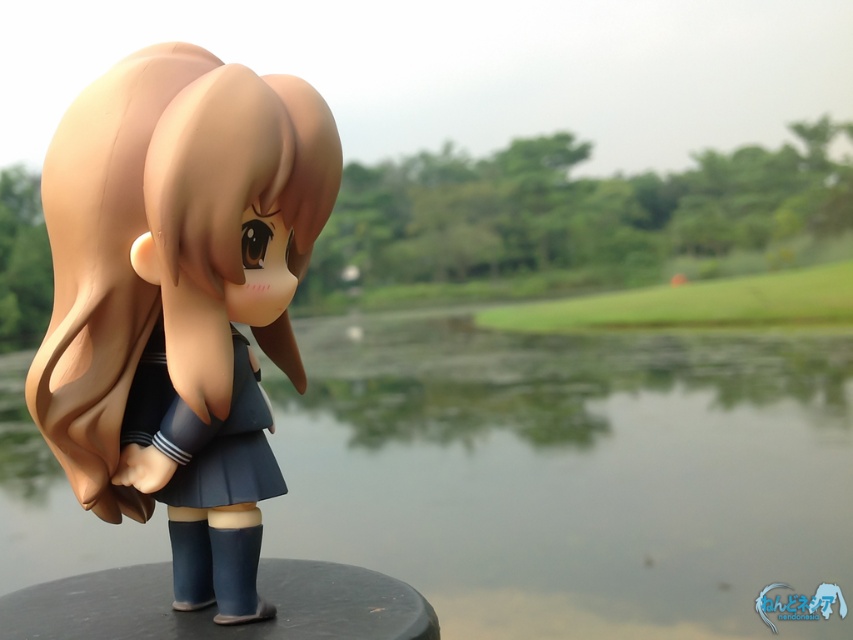
Question: Does transparent water at center come behind satin brown hair at center?

Choices:
 (A) no
 (B) yes

Answer: (B)

Question: Which of the following is the closest to the observer?

Choices:
 (A) transparent water at center
 (B) green grass at center
 (C) satin blue skirt at center

Answer: (C)

Question: Where is transparent water at center located in relation to green grass at center in the image?

Choices:
 (A) above
 (B) below

Answer: (B)

Question: Considering the relative positions of satin brown hair at center and green grass at center in the image provided, where is satin brown hair at center located with respect to green grass at center?

Choices:
 (A) left
 (B) right

Answer: (A)

Question: Which point is closer to the camera taking this photo?

Choices:
 (A) (663, 301)
 (B) (123, 444)
 (C) (132, 356)
 (D) (578, 595)

Answer: (C)

Question: Which is nearer to the satin brown hair at center?

Choices:
 (A) green grass at center
 (B) transparent water at center
 (C) satin blue skirt at center

Answer: (C)